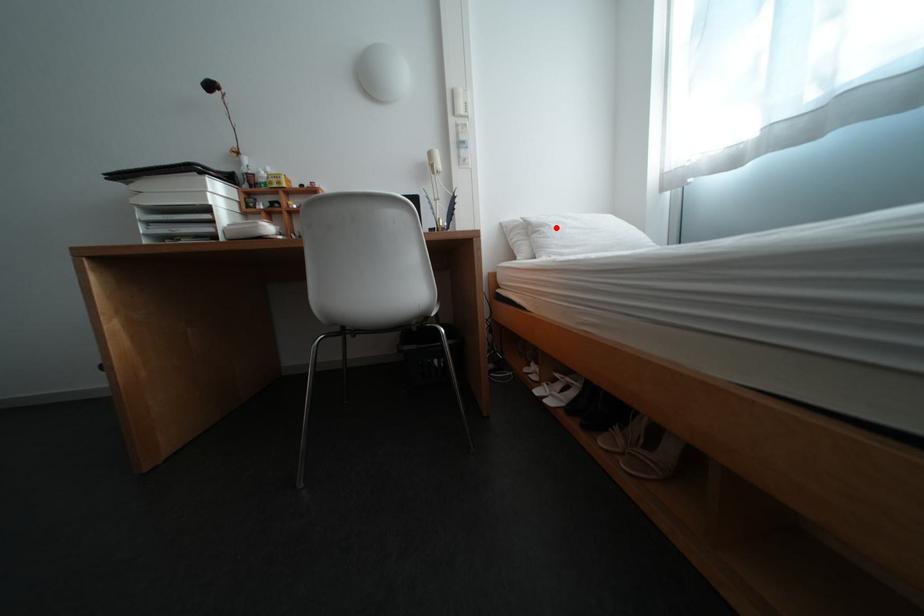
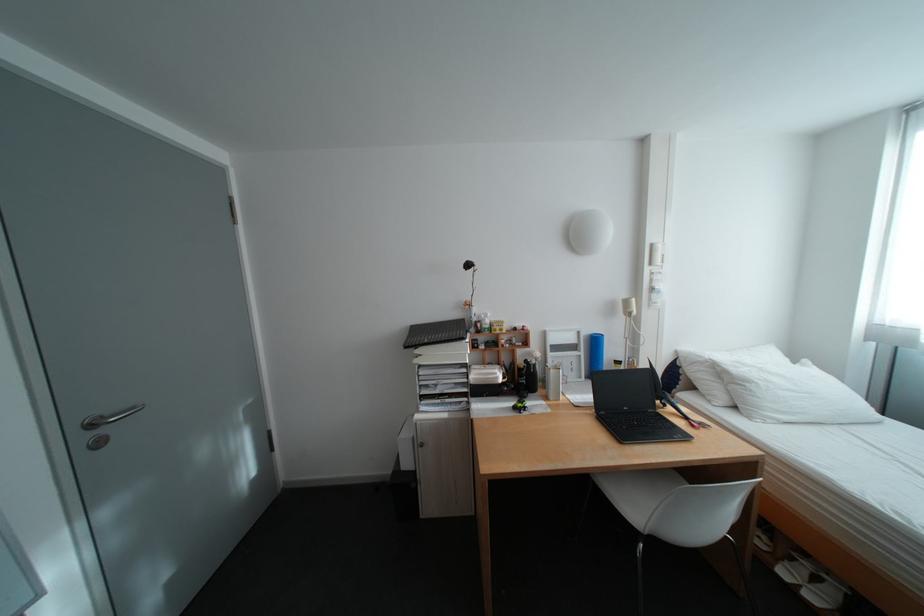
In the second image, find the point that corresponds to the highlighted location in the first image.

(761, 384)